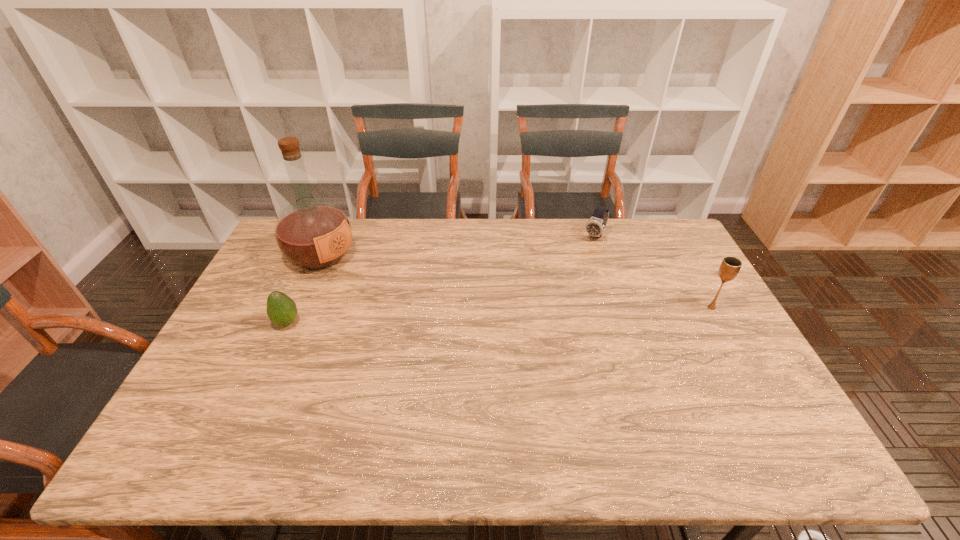
The image size is (960, 540). In the image, there is a desktop. Find the location of `vacant space at the near edge`. vacant space at the near edge is located at coordinates (650, 396).

In the image, there is a desktop. Find the location of `vacant space at the right edge`. vacant space at the right edge is located at coordinates (751, 365).

Find the location of a particular element. Image resolution: width=960 pixels, height=540 pixels. free space at the far right corner is located at coordinates (670, 244).

Identify the location of free space that is in between the second object from right to left and the liquor. The width and height of the screenshot is (960, 540). (458, 246).

The image size is (960, 540). I want to click on free space that is in between the watch and the second nearest object, so click(653, 272).

Find the location of `free area in between the tallest object and the avocado`. free area in between the tallest object and the avocado is located at coordinates pyautogui.click(x=304, y=289).

Locate an element on the screen. free spot between the third farthest object and the nearest object is located at coordinates (499, 315).

Locate an element on the screen. free area in between the liquor and the watch is located at coordinates (458, 246).

The height and width of the screenshot is (540, 960). Identify the location of free spot between the nearest object and the second tallest object. (499, 315).

I want to click on vacant space that's between the watch and the liquor, so click(x=458, y=246).